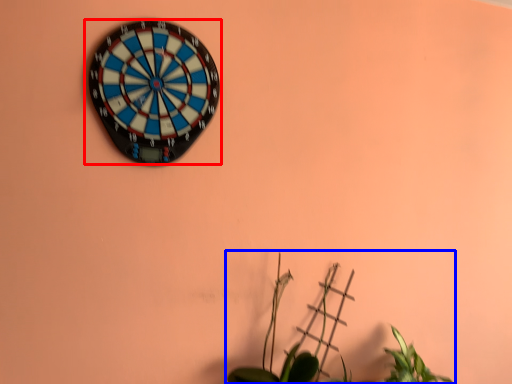
Question: Which point is closer to the camera, wall clock (highlighted by a red box) or houseplant (highlighted by a blue box)?

Choices:
 (A) wall clock
 (B) houseplant

Answer: (B)